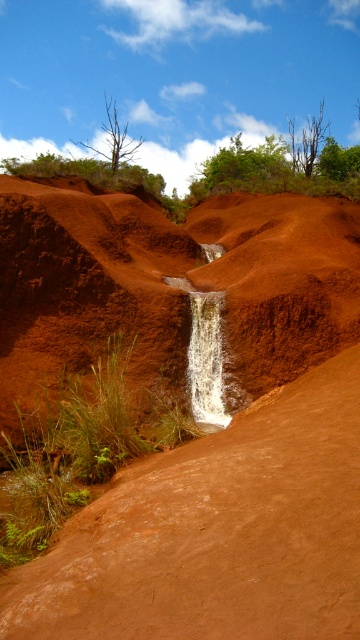
Identify the location of white textured waterfall at center. The image size is (360, 640). (205, 358).

Measure the distance between white textured waterfall at center and camera.

white textured waterfall at center is 27.40 feet from camera.

Which is behind, point (213, 417) or point (120, 148)?

The point (120, 148) is behind.

Find the location of a particular element. Image resolution: width=360 pixels, height=640 pixels. white textured waterfall at center is located at coordinates (205, 358).

Is point (241, 188) farther from camera compared to point (123, 136)?

No, (241, 188) is in front of (123, 136).

Identify the location of green leafy tree at upper center. The width and height of the screenshot is (360, 640). (244, 168).

Where is `dead brown tree at upper center`? dead brown tree at upper center is located at coordinates (114, 140).

Is point (113, 156) less distant than point (316, 150)?

Yes, point (113, 156) is closer to viewer.

Describe the element at coordinates (114, 140) in the screenshot. I see `dead brown tree at upper center` at that location.

Locate an element on the screen. dead brown tree at upper center is located at coordinates (114, 140).